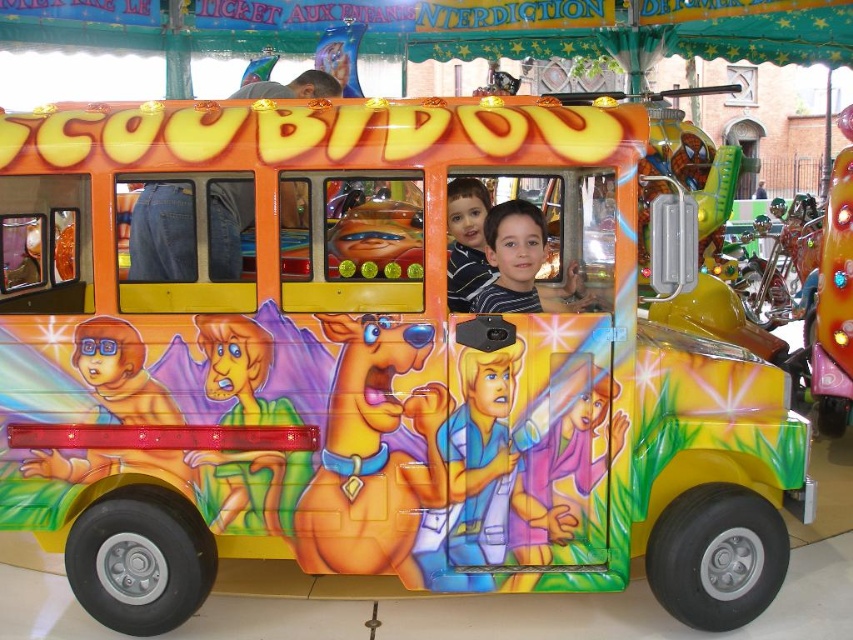
Question: Can you confirm if striped shirt at center is positioned to the right of matte striped shirt at center?

Choices:
 (A) yes
 (B) no

Answer: (A)

Question: Where is striped shirt at center located in relation to matte striped shirt at center in the image?

Choices:
 (A) below
 (B) above

Answer: (A)

Question: Is striped shirt at center wider than matte striped shirt at center?

Choices:
 (A) no
 (B) yes

Answer: (B)

Question: Which object appears closest to the camera in this image?

Choices:
 (A) striped shirt at center
 (B) matte striped shirt at center

Answer: (B)